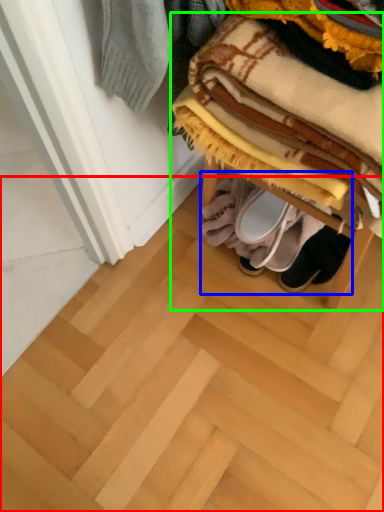
Question: Based on their relative distances, which object is nearer to stair (highlighted by a red box)? Choose from footwear (highlighted by a blue box) and furniture (highlighted by a green box).

Choices:
 (A) footwear
 (B) furniture

Answer: (A)